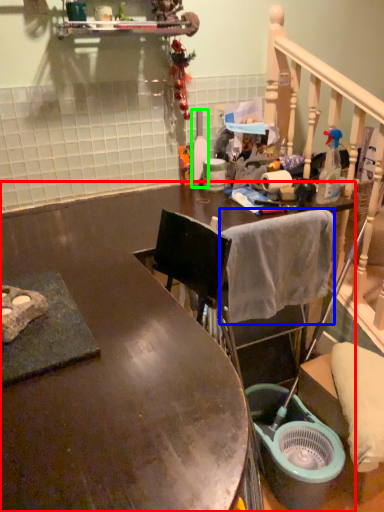
Question: Considering the real-world distances, which object is closest to desk (highlighted by a red box)? bath towel (highlighted by a blue box) or bottle (highlighted by a green box).

Choices:
 (A) bath towel
 (B) bottle

Answer: (A)